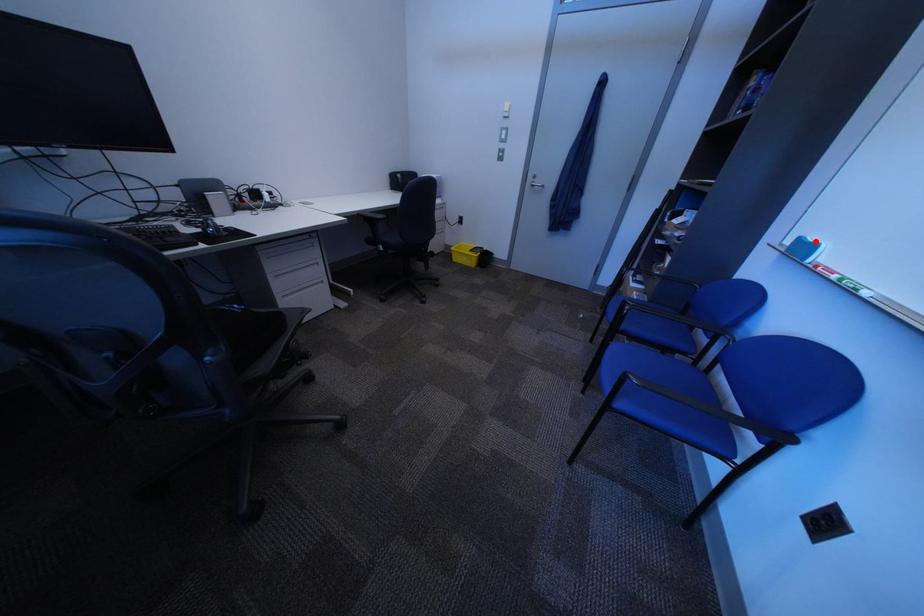
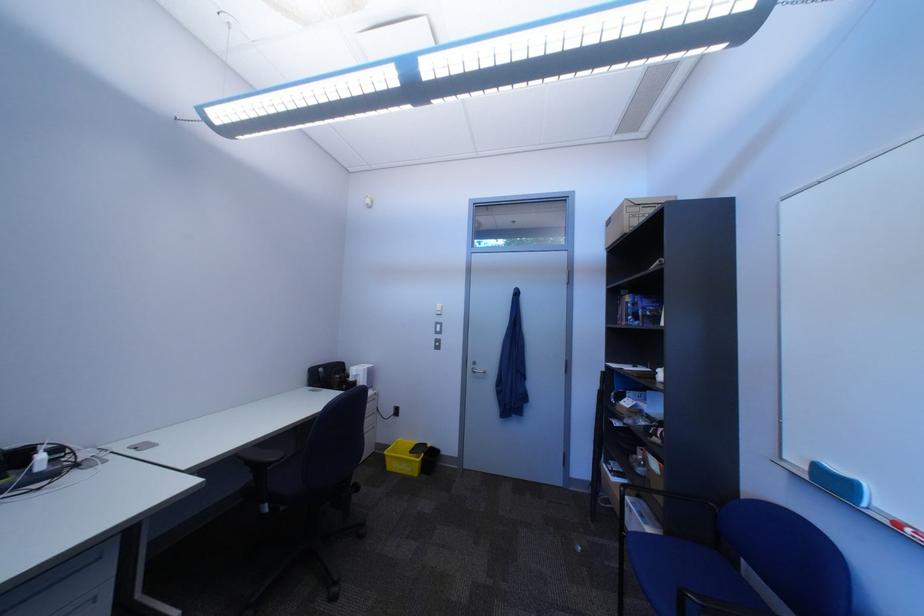
Question: I am providing you with two images of the same scene from different viewpoints. A red point is marked on the first image. Can you still see the location of the red point in image 2?

Choices:
 (A) Yes
 (B) No

Answer: (A)